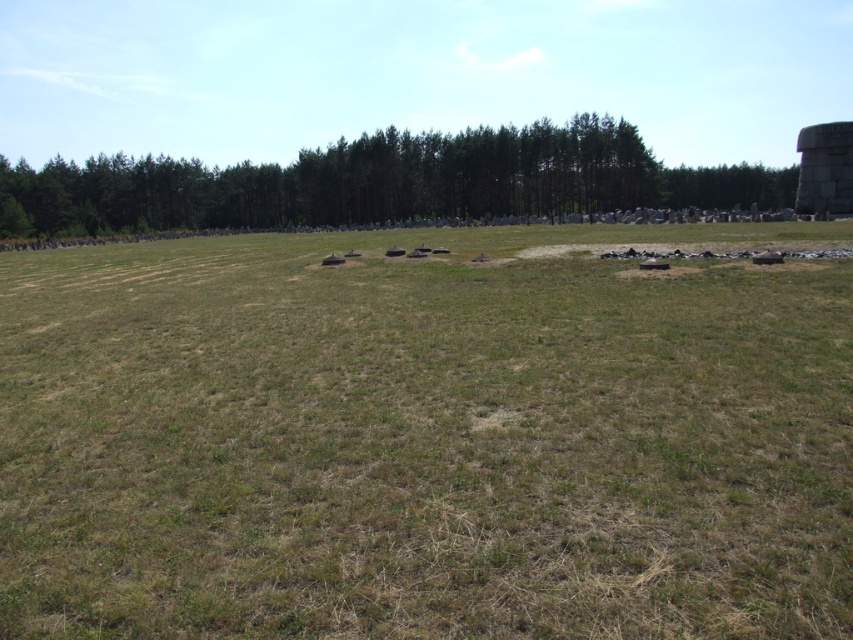
You are a gardener planning to plant new shrubs in the open grassy field. You notice the green grass at center and the green leafy trees at center. Which area would allow more space for the shrubs to spread their roots horizontally?

The green leafy trees at center have a greater width than the green grass at center, so planting shrubs near the green leafy trees at center would provide more horizontal space for the roots to spread.